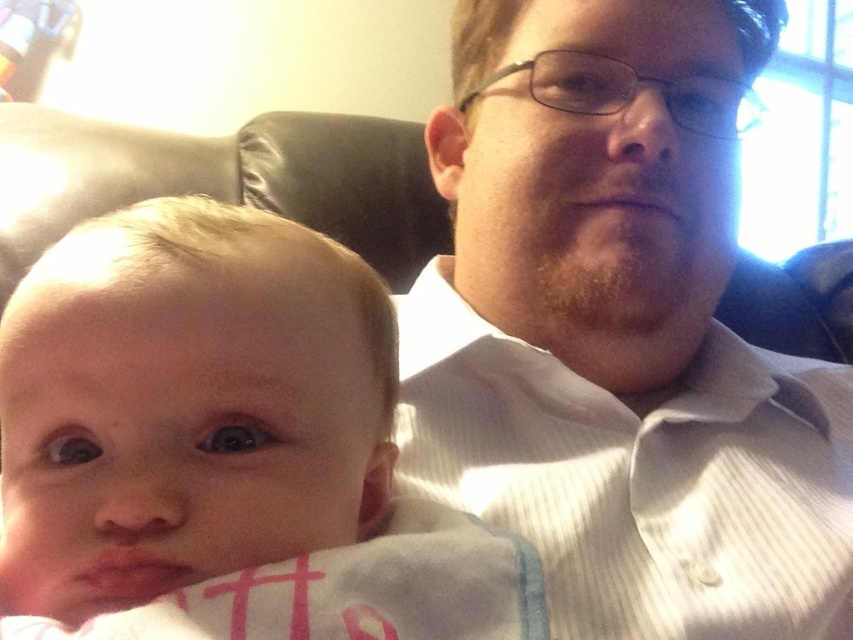
You are a photographer adjusting your camera settings. You want to ensure that the point at coordinates point (537, 80) is in focus. Given that your camera has a depth of field that can clearly capture objects within 60 centimeters from the camera, will this point be within the focus range?

The point (537, 80) is 58.46 centimeters away from the camera. Since the depth of field can capture up to 60 centimeters, the point will be within the focus range.

Looking at this image, you are a photographer adjusting your camera settings to capture a clear shot of the white striped shirt at upper right. The camera lens has a focal length of 50mm and an aperture of f2.8. To ensure the shirt is in focus, what should you adjust if the current focus distance is set to 15 feet?

The white striped shirt at upper right is 17.31 inches from the viewer, so you should increase the focus distance to at least 17.31 inches to ensure it is in focus.

You are a photographer trying to capture a candid shot of both the white striped shirt at upper right and the smooth skin baby at center. However, the baby is partially obscured. Can you adjust your position to see both subjects clearly without moving them?

The smooth skin baby at center is behind the white striped shirt at upper right, so moving your position slightly to the side might allow you to see both subjects clearly by adjusting the angle to avoid obstruction.